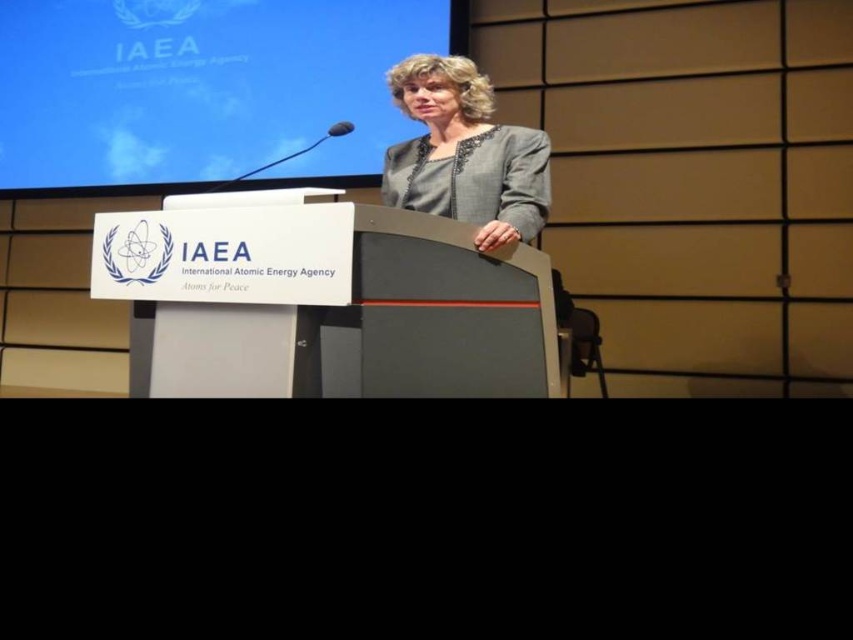
You are an attendee at the IAEA event. You notice the blue glossy screen at upper center and the white plastic podium at center. Which object is located to the left of the other?

The blue glossy screen at upper center is positioned on the left side of white plastic podium at center.

You are an event organizer who needs to set up a microphone stand for the speaker. The microphone stand is 16 inches wide. Can the microphone stand fit between the white plastic podium at center and the gray fabric jacket at center?

The white plastic podium at center and gray fabric jacket at center are 16.58 inches apart from each other. Since the microphone stand is 16 inches wide, it can fit between them as there is enough space.

You are an attendee at the IAEA event and want to take a photo of the speaker. The blue glossy screen at upper center and the gray fabric jacket at center are both in your camera frame. Which object should you focus on if you want to capture the larger one in your photo?

The blue glossy screen at upper center has a larger size compared to the gray fabric jacket at center, so you should focus on the blue glossy screen at upper center to capture the larger one in your photo.